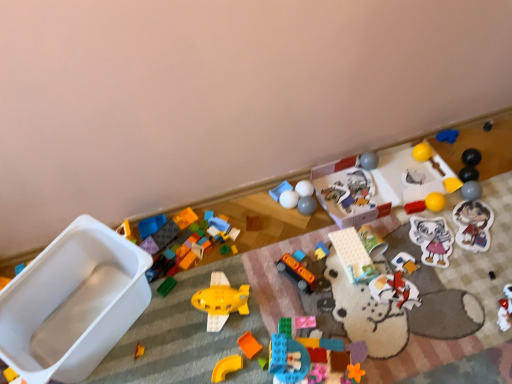
Identify the location of empty space that is in between pink matte block at center, acting as the 14th toy starting from the right, and yellow plastic airplane at center, placed as the fourth toy when sorted from left to right. (273, 310).